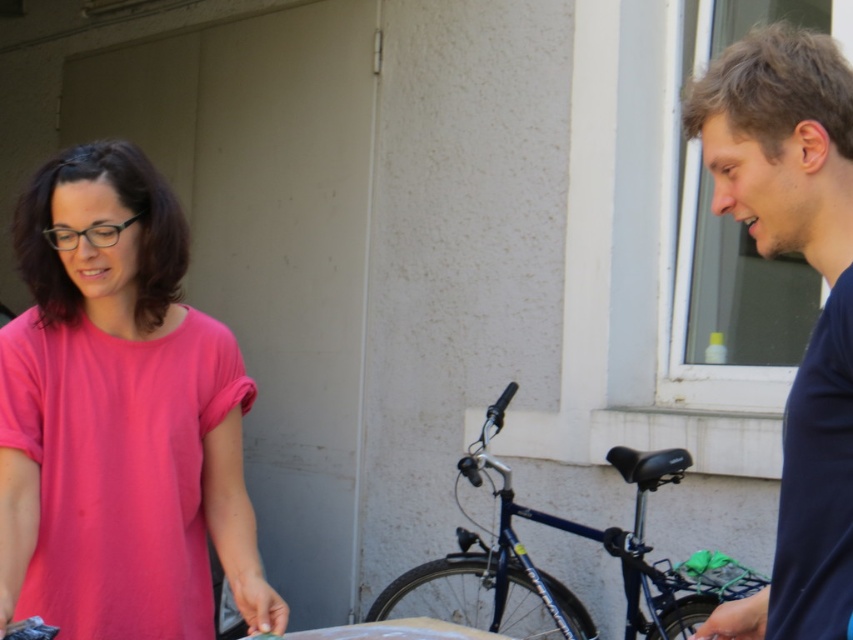
You are a delivery person who needs to place a small package between the pink matte shirt at left and the shiny blue bicycle at center. The package requires at least 1.5 meters of space to be placed safely. Can you fit the package between them?

The pink matte shirt at left and shiny blue bicycle at center are 1.72 meters apart, so yes, the package can be safely placed between them since the distance is sufficient.

You are a photographer trying to capture a photo of the shiny blue bicycle at center without including the dark blue shirt at right in the frame. Given their relative heights, is this possible?

The dark blue shirt at right has a greater height compared to the shiny blue bicycle at center. Therefore, if the photographer positions themselves lower to the ground, they can frame the shot so that the bicycle is visible while the shirt is out of the frame.